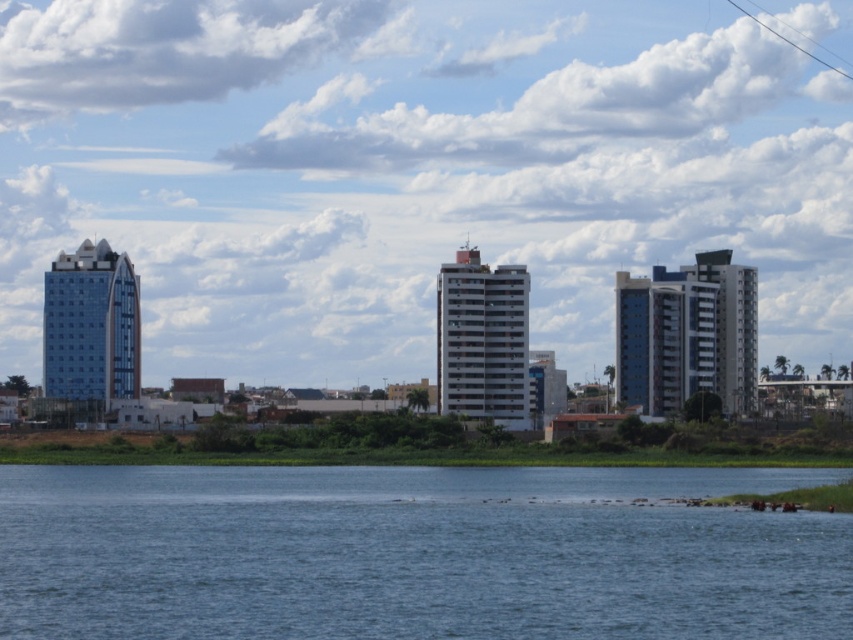
Which of these two, blue water at lower center or glassy blue skyscraper at left, stands taller?

With more height is glassy blue skyscraper at left.

Which is more to the left, blue water at lower center or glassy blue skyscraper at left?

From the viewer's perspective, glassy blue skyscraper at left appears more on the left side.

What do you see at coordinates (415, 554) in the screenshot? I see `blue water at lower center` at bounding box center [415, 554].

This screenshot has width=853, height=640. Find the location of `blue water at lower center`. blue water at lower center is located at coordinates (415, 554).

Who is higher up, blue glass building at right or white smooth building at center?

Positioned higher is white smooth building at center.

Measure the distance between point (x=735, y=401) and camera.

634.48 meters

Does point (634, 300) come closer to viewer compared to point (442, 310)?

No, (634, 300) is further to viewer.

What are the coordinates of `blue glass building at right` in the screenshot? It's located at (688, 336).

Does blue water at lower center have a greater width compared to white smooth building at center?

Correct, the width of blue water at lower center exceeds that of white smooth building at center.

Does blue water at lower center appear under white smooth building at center?

Yes.

At what (x,y) coordinates should I click in order to perform the action: click on blue water at lower center. Please return your answer as a coordinate pair (x, y). This screenshot has width=853, height=640. Looking at the image, I should click on (415, 554).

What are the coordinates of `blue water at lower center` in the screenshot? It's located at (415, 554).